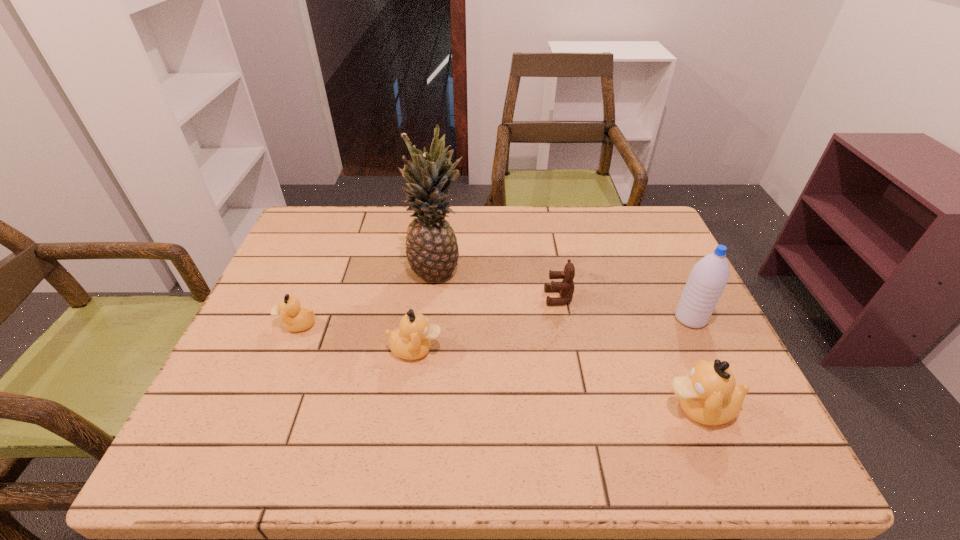
Image resolution: width=960 pixels, height=540 pixels. I want to click on vacant area situated on the face of the nearest object, so click(x=600, y=408).

Find the location of a particular element. This screenshot has height=540, width=960. free space located 0.050m on the face of the nearest object is located at coordinates (638, 408).

Identify the location of free region located on the face of the nearest object. (532, 408).

The width and height of the screenshot is (960, 540). What are the coordinates of `vacant point located on the back of the tallest object` in the screenshot? It's located at (444, 210).

The height and width of the screenshot is (540, 960). What are the coordinates of `vacant space located 0.170m on the face of the teddy bear` in the screenshot? It's located at (480, 298).

What are the coordinates of `vacant space located on the face of the teddy bear` in the screenshot? It's located at (515, 298).

This screenshot has height=540, width=960. In order to click on free space located on the face of the teddy bear in this screenshot , I will do `click(403, 298)`.

Locate an element on the screen. The image size is (960, 540). free spot located 0.240m on the left of the water bottle is located at coordinates [x=578, y=319].

At what (x,y) coordinates should I click in order to perform the action: click on object positioned at the far edge. Please return your answer as a coordinate pair (x, y). The height and width of the screenshot is (540, 960). Looking at the image, I should click on (432, 251).

I want to click on object present at the near edge, so click(709, 395).